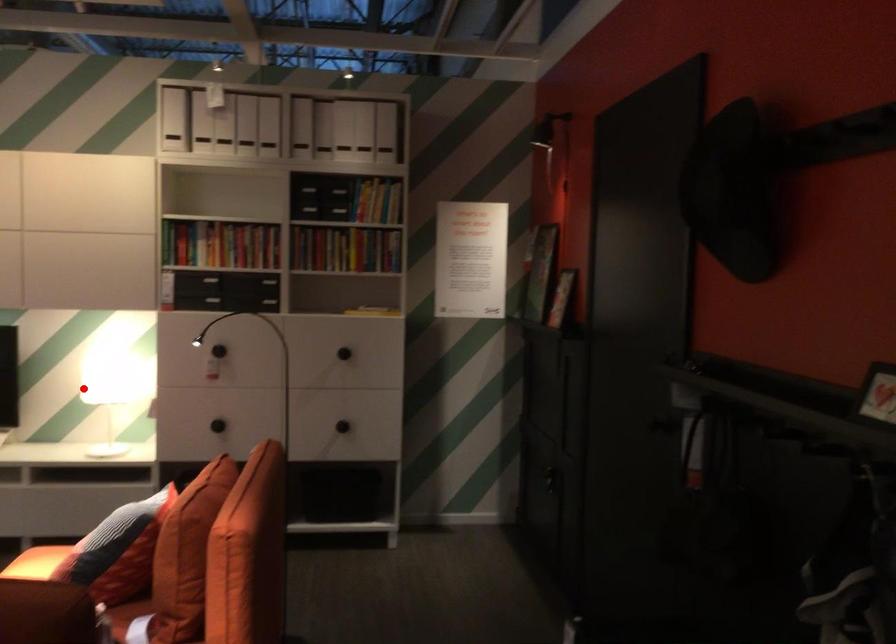
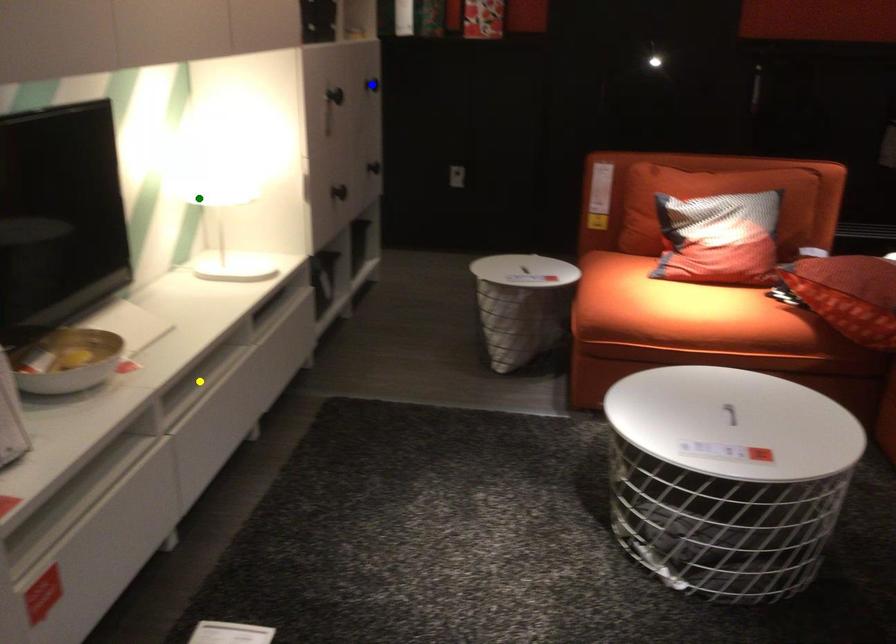
Question: I am providing you with two images of the same scene from different viewpoints. A red point is marked on the first image. You are given multiple points on the second image. Which spot in image 2 lines up with the point in image 1?

Choices:
 (A) green point
 (B) yellow point
 (C) blue point

Answer: (A)